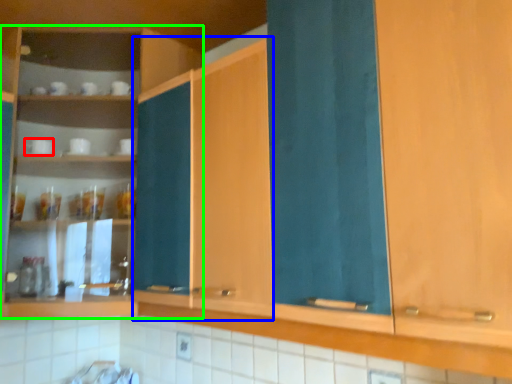
Question: Which object is the closest to the tableware (highlighted by a red box)? Choose among these: cabinetry (highlighted by a blue box) or cabinetry (highlighted by a green box).

Choices:
 (A) cabinetry
 (B) cabinetry

Answer: (B)